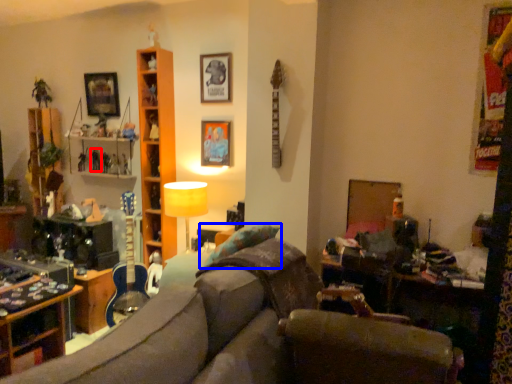
Question: Among these objects, which one is nearest to the camera, toy (highlighted by a red box) or pillow (highlighted by a blue box)?

Choices:
 (A) toy
 (B) pillow

Answer: (B)